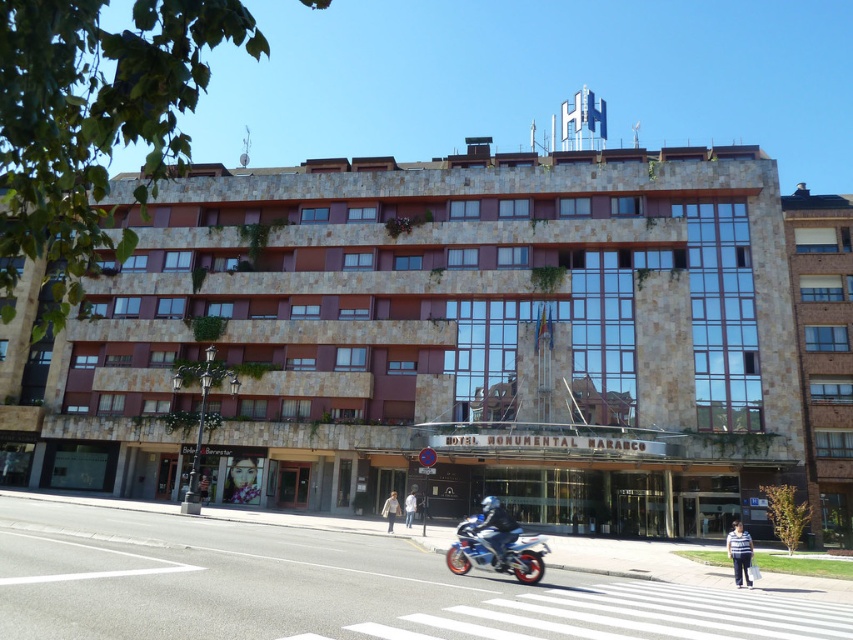
You are standing at the entrance of the building and want to find the person wearing a white striped shirt at lower right. Which direction should you look to locate them?

You should look towards the lower right direction to find the white striped shirt at lower right, as it is located at point (740, 552).

You are standing at the point closer to the building. There are two points marked in the image, one at coordinates point (733, 545) and the other at point (409, 524). Which point is closer to the building?

Point (733, 545) is in front of point (409, 524), so the point closer to the building is point (733, 545).

You are a photographer standing on the sidewalk. You notice two people wearing white shirts in the scene. One is wearing a white striped shirt at lower right and the other a white cotton shirt at center. Which person should you focus on to capture a taller subject?

The white striped shirt at lower right is taller than the white cotton shirt at center, so you should focus on the person wearing the white striped shirt at lower right to capture a taller subject.